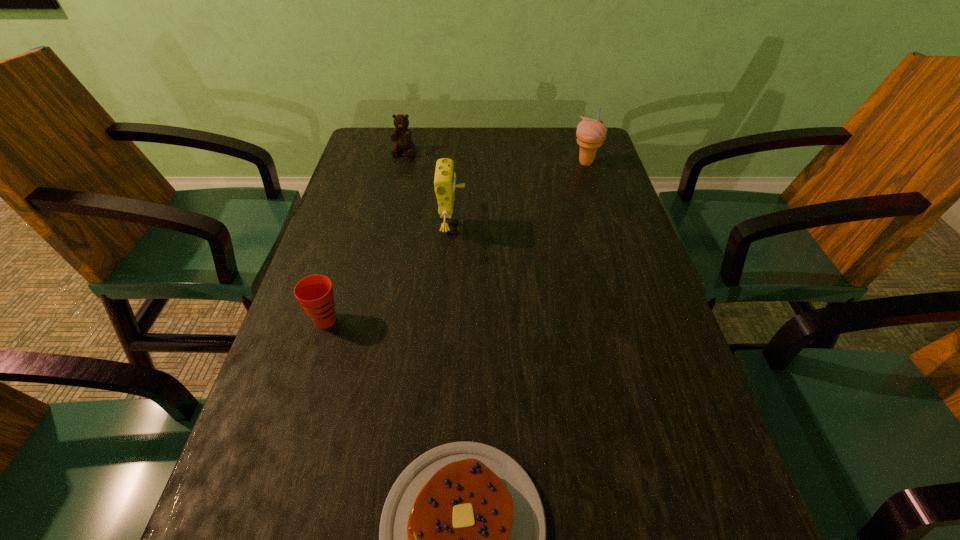
Locate an element on the screen. the third farthest object is located at coordinates (445, 177).

The image size is (960, 540). I want to click on the rightmost object, so click(590, 133).

Locate an element on the screen. This screenshot has height=540, width=960. teddy bear is located at coordinates (401, 136).

Where is `the second nearest object`? the second nearest object is located at coordinates (x=314, y=293).

The height and width of the screenshot is (540, 960). I want to click on cup, so click(314, 293).

In order to click on free space located on the face of the third nearest object in this screenshot , I will do `click(523, 228)`.

Identify the location of vacant point located 0.050m on the front of the rightmost object. tap(591, 180).

Where is `free region located on the face of the teddy bear`? free region located on the face of the teddy bear is located at coordinates (393, 202).

Find the location of a particular element. The width and height of the screenshot is (960, 540). free spot located on the back of the fourth farthest object is located at coordinates (361, 205).

Where is `icecream present at the far edge`? icecream present at the far edge is located at coordinates (590, 133).